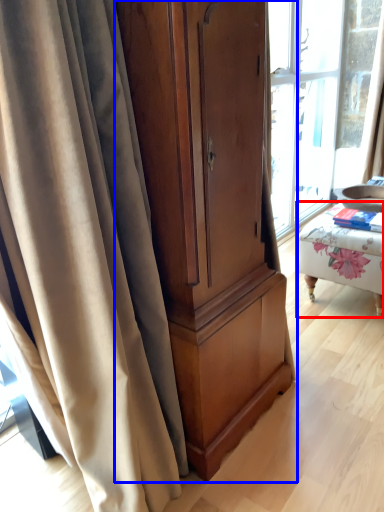
Question: Which object is closer to the camera taking this photo, furniture (highlighted by a red box) or cabinetry (highlighted by a blue box)?

Choices:
 (A) furniture
 (B) cabinetry

Answer: (B)